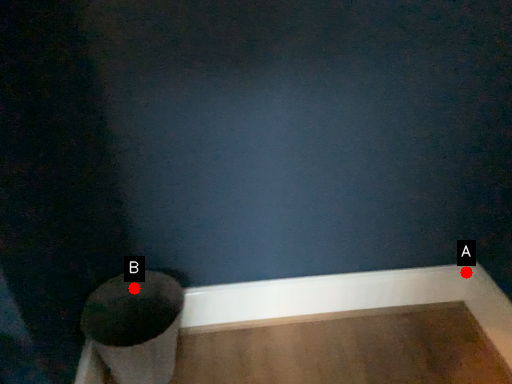
Question: Two points are circled on the image, labeled by A and B beside each circle. Among these points, which one is nearest to the camera?

Choices:
 (A) A is closer
 (B) B is closer

Answer: (B)